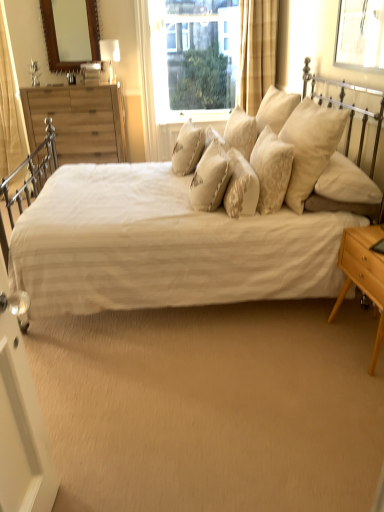
You are a GUI agent. You are given a task and a screenshot of the screen. Output one action in this format:
    pyautogui.click(x=<x>, y=<y>)
    Task: Click on the free space to the back side of white glossy screen door at lower left
    
    Given the screenshot: What is the action you would take?
    pyautogui.click(x=75, y=463)